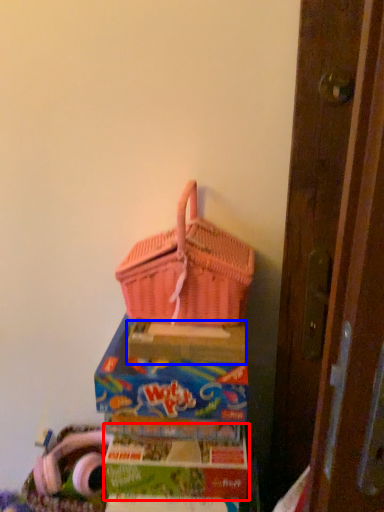
Question: Which object appears farthest to the camera in this image, box (highlighted by a red box) or cardboard box (highlighted by a blue box)?

Choices:
 (A) box
 (B) cardboard box

Answer: (A)